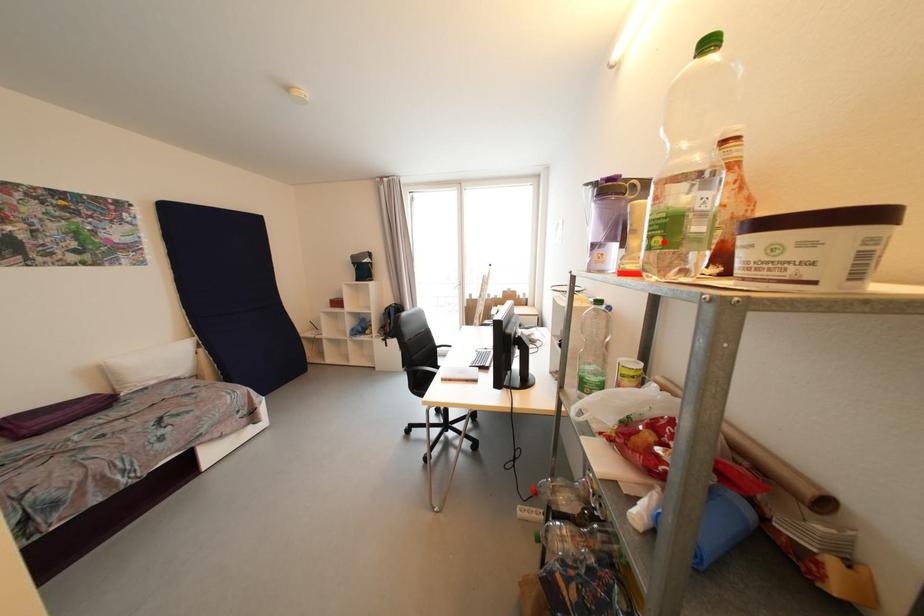
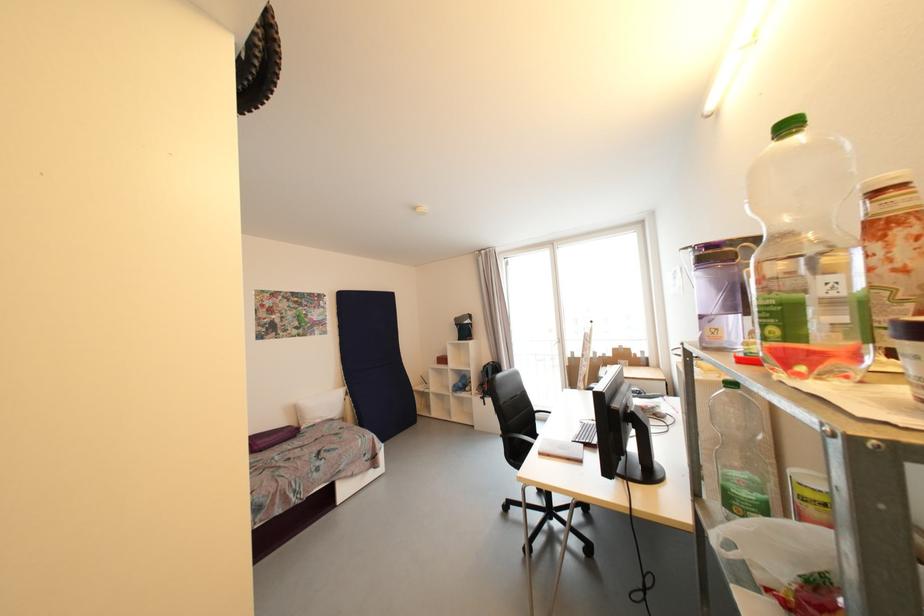
Find the pixel in the second image that matches the highlighted location in the first image.

(780, 331)